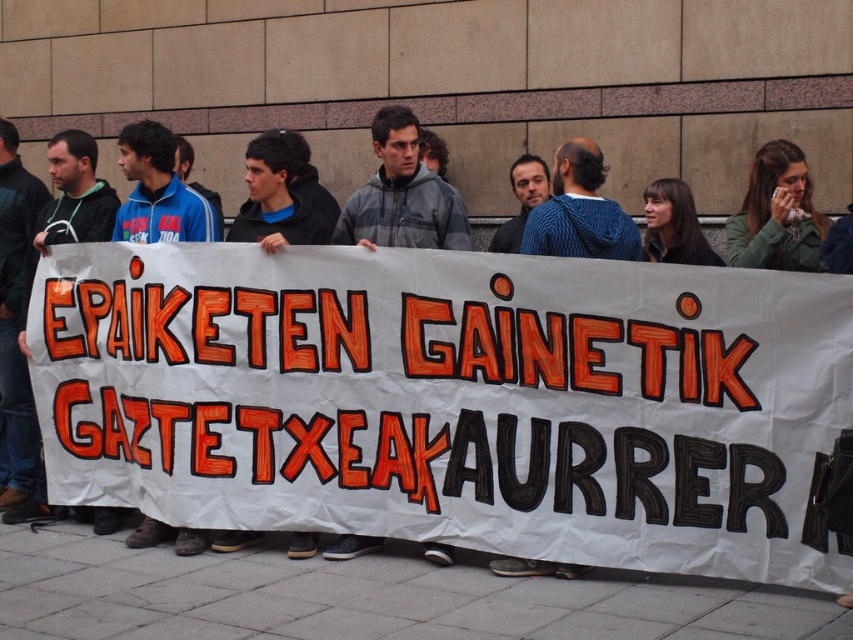
Who is shorter, white paper banner at center or green fabric scarf at upper right?

green fabric scarf at upper right

Does point (746, 429) lie in front of point (809, 180)?

Yes.

Where is `white paper banner at center`? white paper banner at center is located at coordinates (451, 401).